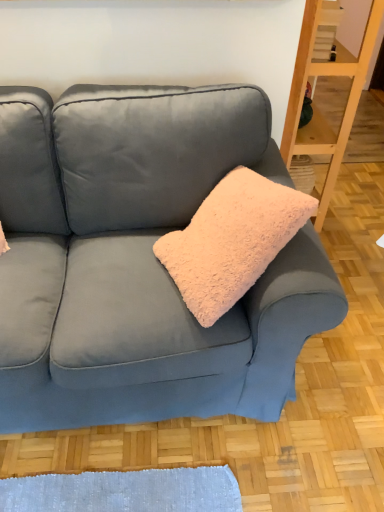
Question: Considering the relative sizes of wooden shelf at right and velvet blue couch at center in the image provided, is wooden shelf at right wider than velvet blue couch at center?

Choices:
 (A) yes
 (B) no

Answer: (B)

Question: Is wooden shelf at right taller than velvet blue couch at center?

Choices:
 (A) yes
 (B) no

Answer: (A)

Question: From the image's perspective, is wooden shelf at right beneath velvet blue couch at center?

Choices:
 (A) yes
 (B) no

Answer: (B)

Question: From a real-world perspective, is wooden shelf at right on top of velvet blue couch at center?

Choices:
 (A) yes
 (B) no

Answer: (A)

Question: Is wooden shelf at right placed right next to velvet blue couch at center?

Choices:
 (A) no
 (B) yes

Answer: (A)

Question: Is wooden shelf at right in front of or behind velvet blue couch at center in the image?

Choices:
 (A) front
 (B) behind

Answer: (B)

Question: Visually, is wooden shelf at right positioned to the left or to the right of velvet blue couch at center?

Choices:
 (A) left
 (B) right

Answer: (B)

Question: Does point (370, 5) appear closer or farther from the camera than point (253, 300)?

Choices:
 (A) farther
 (B) closer

Answer: (A)

Question: Is wooden shelf at right inside or outside of velvet blue couch at center?

Choices:
 (A) inside
 (B) outside

Answer: (B)

Question: Does point (x=64, y=117) appear closer or farther from the camera than point (x=244, y=244)?

Choices:
 (A) closer
 (B) farther

Answer: (B)

Question: Which is correct: velvet blue couch at center is inside fuzzy pink pillow at center, or outside of it?

Choices:
 (A) inside
 (B) outside

Answer: (B)

Question: Is velvet blue couch at center wider or thinner than fuzzy pink pillow at center?

Choices:
 (A) wide
 (B) thin

Answer: (A)

Question: Considering the positions of velvet blue couch at center and fuzzy pink pillow at center in the image, is velvet blue couch at center bigger or smaller than fuzzy pink pillow at center?

Choices:
 (A) small
 (B) big

Answer: (B)

Question: Visually, is velvet blue couch at center positioned to the left or to the right of wooden shelf at right?

Choices:
 (A) right
 (B) left

Answer: (B)

Question: Is velvet blue couch at center bigger or smaller than wooden shelf at right?

Choices:
 (A) small
 (B) big

Answer: (B)